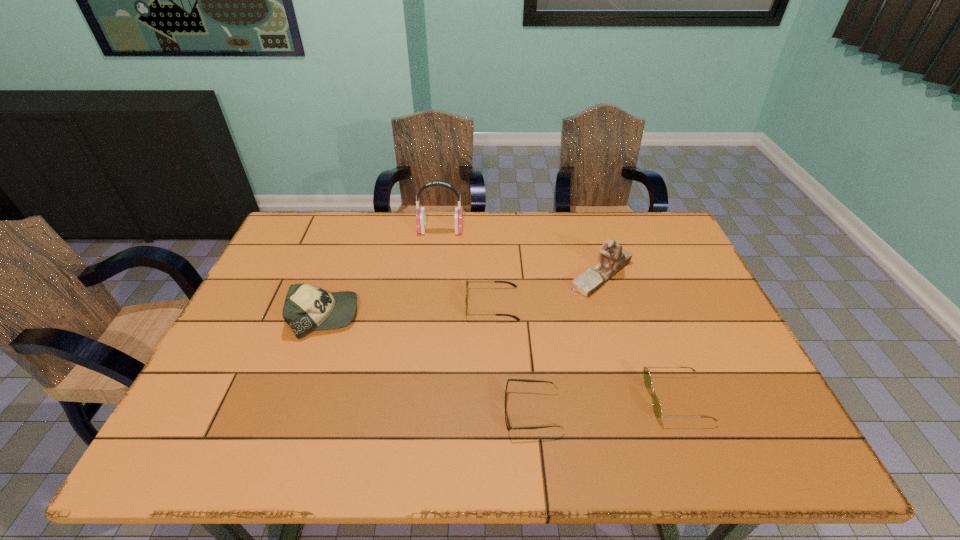
Locate an element on the screen. empty space between the shortest sunglasses and the farthest sunglasses is located at coordinates (513, 357).

Find the location of `vacant region between the rightmost sunglasses and the third tallest object`. vacant region between the rightmost sunglasses and the third tallest object is located at coordinates (501, 357).

At what (x,y) coordinates should I click in order to perform the action: click on free space between the rightmost sunglasses and the earphone. Please return your answer as a coordinate pair (x, y). The height and width of the screenshot is (540, 960). Looking at the image, I should click on (559, 314).

Identify which object is located as the fourth nearest to the tallest object. Please provide its 2D coordinates. Your answer should be formatted as a tuple, i.e. [(x, y)], where the tuple contains the x and y coordinates of a point satisfying the conditions above.

[(509, 427)]

Select which object is the second closest to the tallest object. Please provide its 2D coordinates. Your answer should be formatted as a tuple, i.e. [(x, y)], where the tuple contains the x and y coordinates of a point satisfying the conditions above.

[(307, 308)]

You are a GUI agent. You are given a task and a screenshot of the screen. Output one action in this format:
    pyautogui.click(x=<x>, y=<y>)
    Task: Click on the sunglasses that stands as the closest to the farthest sunglasses
    Image resolution: width=960 pixels, height=540 pixels.
    Given the screenshot: What is the action you would take?
    pyautogui.click(x=509, y=427)

Locate which sunglasses is the second closest to the farthest sunglasses. Please provide its 2D coordinates. Your answer should be formatted as a tuple, i.e. [(x, y)], where the tuple contains the x and y coordinates of a point satisfying the conditions above.

[(657, 409)]